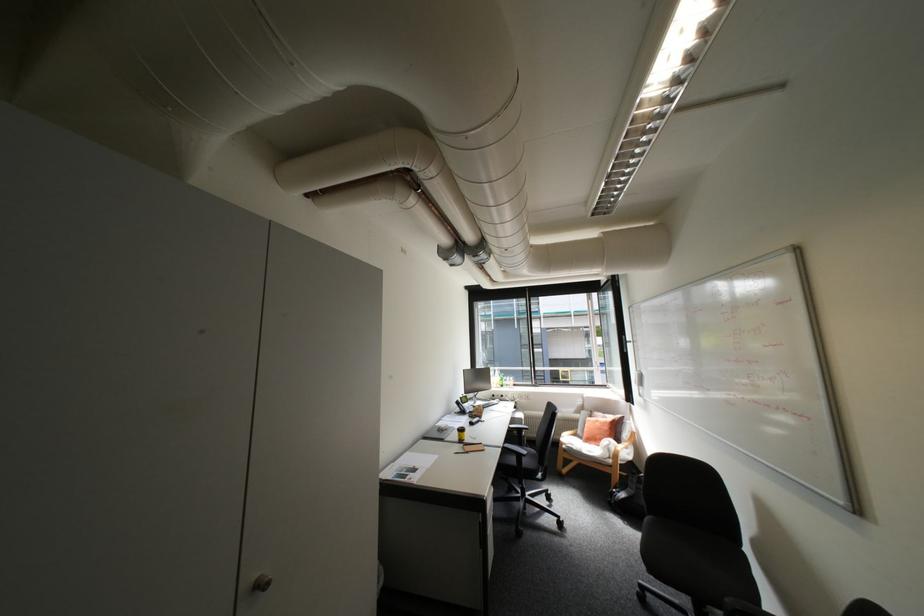
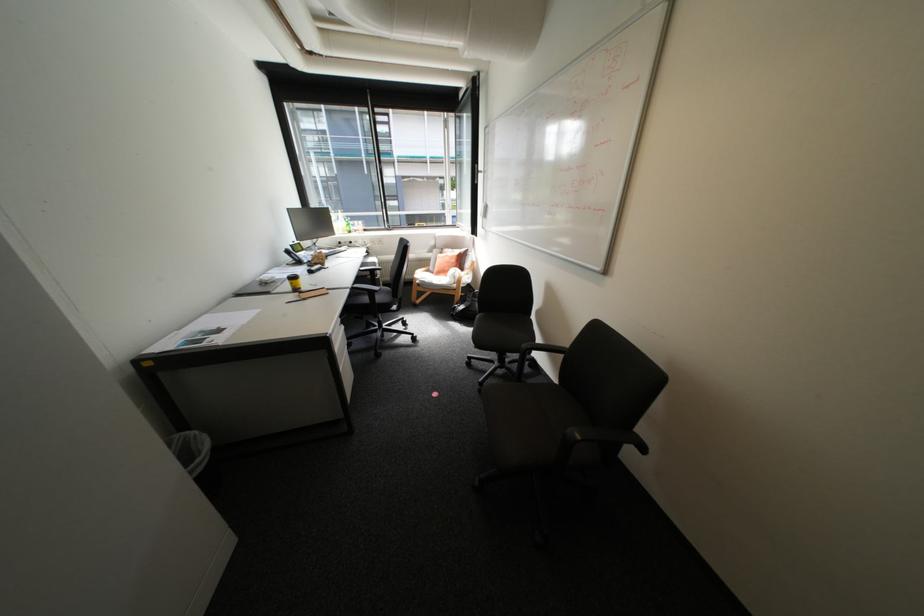
Locate, in the second image, the point that corresponds to point (465, 436) in the first image.

(296, 286)